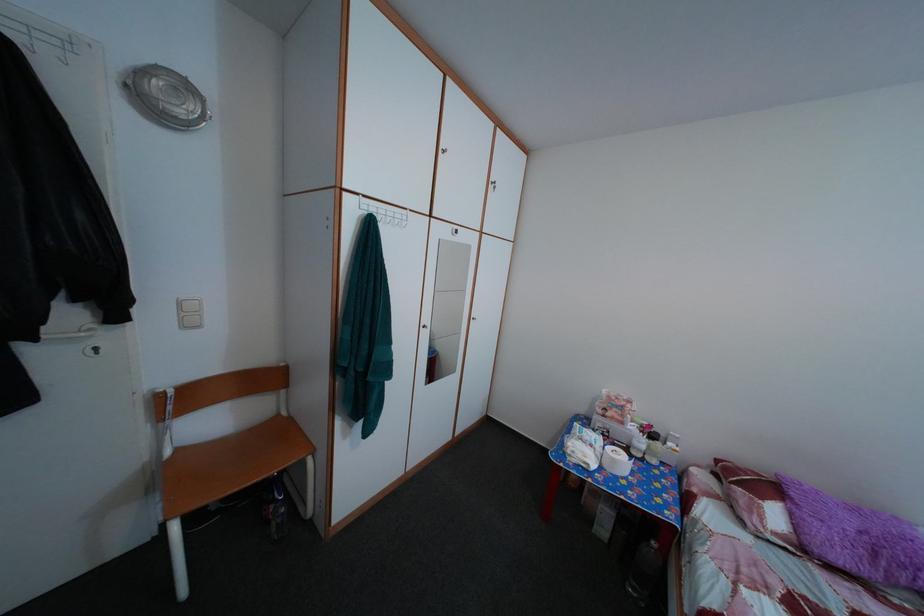
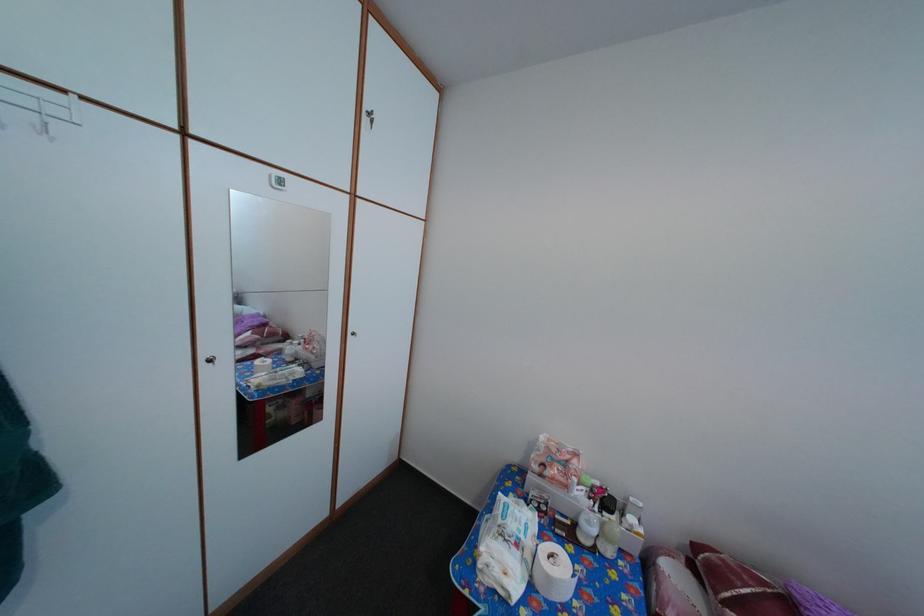
In the second image, find the point that corresponds to (x=415, y=225) in the first image.

(66, 120)